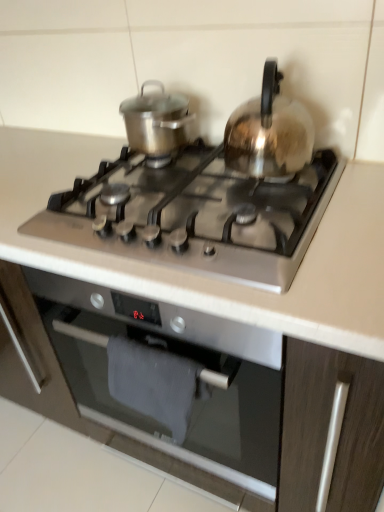
At what (x,y) coordinates should I click in order to perform the action: click on satin silver gas stove at center. Please return your answer as a coordinate pair (x, y). Looking at the image, I should click on (199, 217).

What do you see at coordinates (171, 394) in the screenshot? Image resolution: width=384 pixels, height=512 pixels. I see `satin silver oven at center` at bounding box center [171, 394].

Describe the element at coordinates (269, 132) in the screenshot. Image resolution: width=384 pixels, height=512 pixels. I see `satin silver kettle at upper right, positioned as the second kitchen appliance in left-to-right order` at that location.

Where is `satin silver gas stove at center`? The height and width of the screenshot is (512, 384). satin silver gas stove at center is located at coordinates (199, 217).

Between satin silver gas stove at center and satin silver kettle at upper right, positioned as the second kitchen appliance in left-to-right order, which one appears on the right side from the viewer's perspective?

satin silver kettle at upper right, positioned as the second kitchen appliance in left-to-right order.

Is satin silver gas stove at center beside satin silver kettle at upper right, the first kitchen appliance viewed from the right?

No.

Is point (225, 269) more distant than point (267, 82)?

No.

Considering the positions of point (94, 211) and point (136, 135), is point (94, 211) closer or farther from the camera than point (136, 135)?

Point (94, 211) appears to be closer to the viewer than point (136, 135).

Is satin silver gas stove at center looking in the opposite direction of shiny metallic pot at upper left, the 1th kitchen appliance viewed from the left?

No, satin silver gas stove at center is not facing away from shiny metallic pot at upper left, the 1th kitchen appliance viewed from the left.

From a real-world perspective, which object rests below the other?

satin silver gas stove at center.

Which object is more forward, shiny metallic pot at upper left, the 1th kitchen appliance viewed from the left, or satin silver kettle at upper right, positioned as the second kitchen appliance in left-to-right order?

satin silver kettle at upper right, positioned as the second kitchen appliance in left-to-right order, is more forward.

Considering the sizes of objects shiny metallic pot at upper left, the 2th kitchen appliance from the right, and satin silver kettle at upper right, the first kitchen appliance viewed from the right, in the image provided, who is wider, shiny metallic pot at upper left, the 2th kitchen appliance from the right, or satin silver kettle at upper right, the first kitchen appliance viewed from the right,?

With larger width is satin silver kettle at upper right, the first kitchen appliance viewed from the right.

Does shiny metallic pot at upper left, the 1th kitchen appliance viewed from the left, turn towards satin silver kettle at upper right, positioned as the second kitchen appliance in left-to-right order?

No, shiny metallic pot at upper left, the 1th kitchen appliance viewed from the left, is not turned towards satin silver kettle at upper right, positioned as the second kitchen appliance in left-to-right order.

Measure the distance between shiny metallic pot at upper left, the 1th kitchen appliance viewed from the left, and satin silver kettle at upper right, the first kitchen appliance viewed from the right.

The distance of shiny metallic pot at upper left, the 1th kitchen appliance viewed from the left, from satin silver kettle at upper right, the first kitchen appliance viewed from the right, is 8.26 inches.

Does satin silver oven at center have a lesser width compared to shiny metallic pot at upper left, the 2th kitchen appliance from the right?

In fact, satin silver oven at center might be wider than shiny metallic pot at upper left, the 2th kitchen appliance from the right.

Does satin silver oven at center appear on the right side of shiny metallic pot at upper left, the 2th kitchen appliance from the right?

Result: Yes, satin silver oven at center is to the right of shiny metallic pot at upper left, the 2th kitchen appliance from the right.

From the image's perspective, is satin silver oven at center positioned above or below shiny metallic pot at upper left, the 2th kitchen appliance from the right?

Based on their image positions, satin silver oven at center is located beneath shiny metallic pot at upper left, the 2th kitchen appliance from the right.

From a real-world perspective, who is located higher, satin silver oven at center or shiny metallic pot at upper left, the 1th kitchen appliance viewed from the left?

shiny metallic pot at upper left, the 1th kitchen appliance viewed from the left, from a real-world perspective.

Relative to satin silver kettle at upper right, the first kitchen appliance viewed from the right, is satin silver oven at center in front or behind?

In the image, satin silver oven at center appears in front of satin silver kettle at upper right, the first kitchen appliance viewed from the right.

Considering the relative sizes of satin silver oven at center and satin silver kettle at upper right, the first kitchen appliance viewed from the right, in the image provided, is satin silver oven at center shorter than satin silver kettle at upper right, the first kitchen appliance viewed from the right,?

Incorrect, the height of satin silver oven at center does not fall short of that of satin silver kettle at upper right, the first kitchen appliance viewed from the right.

From the image's perspective, is satin silver oven at center above satin silver kettle at upper right, the first kitchen appliance viewed from the right?

No, from the image's perspective, satin silver oven at center is not over satin silver kettle at upper right, the first kitchen appliance viewed from the right.

Looking at this image, from a real-world perspective, who is located lower, satin silver oven at center or satin silver kettle at upper right, the first kitchen appliance viewed from the right?

From a 3D spatial view, satin silver oven at center is below.

Measure the distance from shiny metallic pot at upper left, the 1th kitchen appliance viewed from the left, to satin silver gas stove at center.

9.04 inches.

Is shiny metallic pot at upper left, the 1th kitchen appliance viewed from the left, to the left or to the right of satin silver gas stove at center in the image?

Based on their positions, shiny metallic pot at upper left, the 1th kitchen appliance viewed from the left, is located to the left of satin silver gas stove at center.

Which is in front, point (138, 130) or point (140, 243)?

The point (140, 243) is closer.

Is shiny metallic pot at upper left, the 2th kitchen appliance from the right, shorter than satin silver gas stove at center?

No, shiny metallic pot at upper left, the 2th kitchen appliance from the right, is not shorter than satin silver gas stove at center.

At what (x,y) coordinates should I click in order to perform the action: click on oven behind the satin silver gas stove at center. Please return your answer as a coordinate pair (x, y). This screenshot has width=384, height=512. Looking at the image, I should click on (171, 394).

Can you tell me how much satin silver gas stove at center and satin silver oven at center differ in facing direction?

There is a 1.05-degree angle between the facing directions of satin silver gas stove at center and satin silver oven at center.

Between satin silver gas stove at center and satin silver oven at center, which one has smaller width?

satin silver gas stove at center is thinner.

Is satin silver gas stove at center bigger than satin silver oven at center?

Actually, satin silver gas stove at center might be smaller than satin silver oven at center.

Where is `kitchen appliance on the right of satin silver gas stove at center`? kitchen appliance on the right of satin silver gas stove at center is located at coordinates (269, 132).

Find the location of a particular element. This screenshot has width=384, height=512. kitchen appliance that is the 1st one above the satin silver gas stove at center (from a real-world perspective) is located at coordinates (157, 121).

Based on their spatial positions, is satin silver gas stove at center or satin silver kettle at upper right, the first kitchen appliance viewed from the right, further from shiny metallic pot at upper left, the 2th kitchen appliance from the right?

Based on the image, satin silver gas stove at center appears to be further to shiny metallic pot at upper left, the 2th kitchen appliance from the right.

Based on their spatial positions, is satin silver oven at center or satin silver kettle at upper right, the first kitchen appliance viewed from the right, further from shiny metallic pot at upper left, the 1th kitchen appliance viewed from the left?

Among the two, satin silver oven at center is located further to shiny metallic pot at upper left, the 1th kitchen appliance viewed from the left.

When comparing their distances from satin silver oven at center, does satin silver gas stove at center or satin silver kettle at upper right, positioned as the second kitchen appliance in left-to-right order, seem further?

The object further to satin silver oven at center is satin silver kettle at upper right, positioned as the second kitchen appliance in left-to-right order.

From the image, which object appears to be nearer to satin silver gas stove at center, satin silver kettle at upper right, positioned as the second kitchen appliance in left-to-right order, or satin silver oven at center?

The object closer to satin silver gas stove at center is satin silver kettle at upper right, positioned as the second kitchen appliance in left-to-right order.

When comparing their distances from satin silver oven at center, does shiny metallic pot at upper left, the 2th kitchen appliance from the right, or satin silver gas stove at center seem further?

shiny metallic pot at upper left, the 2th kitchen appliance from the right, is further to satin silver oven at center.

From the image, which object appears to be farther from shiny metallic pot at upper left, the 2th kitchen appliance from the right, satin silver gas stove at center or satin silver oven at center?

satin silver oven at center.

Which object lies nearer to the anchor point satin silver oven at center, satin silver gas stove at center or shiny metallic pot at upper left, the 2th kitchen appliance from the right?

satin silver gas stove at center is positioned closer to the anchor satin silver oven at center.

Estimate the real-world distances between objects in this image. Which object is further from satin silver gas stove at center, satin silver oven at center or shiny metallic pot at upper left, the 2th kitchen appliance from the right?

satin silver oven at center is positioned further to the anchor satin silver gas stove at center.

Find the location of a particular element. kitchen appliance between shiny metallic pot at upper left, the 2th kitchen appliance from the right, and satin silver oven at center in the up-down direction is located at coordinates (269, 132).

Find the location of `gas stove between satin silver kettle at upper right, positioned as the second kitchen appliance in left-to-right order, and satin silver oven at center, in the vertical direction`. gas stove between satin silver kettle at upper right, positioned as the second kitchen appliance in left-to-right order, and satin silver oven at center, in the vertical direction is located at coordinates (199, 217).

Where is `gas stove that lies between shiny metallic pot at upper left, the 1th kitchen appliance viewed from the left, and satin silver oven at center from top to bottom`? gas stove that lies between shiny metallic pot at upper left, the 1th kitchen appliance viewed from the left, and satin silver oven at center from top to bottom is located at coordinates (199, 217).

Locate an element on the screen. This screenshot has height=512, width=384. kitchen appliance located between satin silver gas stove at center and shiny metallic pot at upper left, the 1th kitchen appliance viewed from the left, in the depth direction is located at coordinates (269, 132).